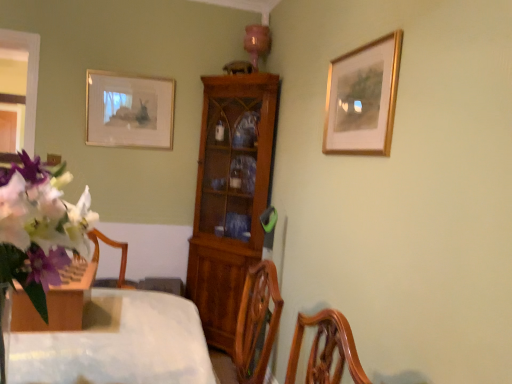
The height and width of the screenshot is (384, 512). I want to click on gold/golden picture frame at upper right, placed as the 2th picture frame when sorted from back to front, so click(362, 98).

Describe the element at coordinates (362, 98) in the screenshot. I see `gold/golden picture frame at upper right, the 2th picture frame when ordered from left to right` at that location.

Locate an element on the screen. wooden cabinet at center is located at coordinates (230, 196).

Is wooden cabinet at center positioned with its back to white matte flower at left?

No, white matte flower at left is not at the back of wooden cabinet at center.

In the image, is wooden cabinet at center positioned in front of or behind white matte flower at left?

wooden cabinet at center is positioned farther from the viewer than white matte flower at left.

What are the coordinates of `cabinetry on the right of white matte flower at left` in the screenshot? It's located at (230, 196).

Is wooden cabinet at center not close to white matte flower at left?

That's right, there is a large distance between wooden cabinet at center and white matte flower at left.

From the picture: Does wooden cabinet at center have a greater width compared to gold/golden picture frame at upper right, which is the first picture frame from front to back?

Indeed, wooden cabinet at center has a greater width compared to gold/golden picture frame at upper right, which is the first picture frame from front to back.

Can you confirm if wooden cabinet at center is bigger than gold/golden picture frame at upper right, placed as the 2th picture frame when sorted from back to front?

Correct, wooden cabinet at center is larger in size than gold/golden picture frame at upper right, placed as the 2th picture frame when sorted from back to front.

Considering the relative sizes of wooden cabinet at center and gold/golden picture frame at upper right, the 2th picture frame when ordered from left to right, in the image provided, is wooden cabinet at center taller than gold/golden picture frame at upper right, the 2th picture frame when ordered from left to right,?

Yes, wooden cabinet at center is taller than gold/golden picture frame at upper right, the 2th picture frame when ordered from left to right.

Relative to gold/golden picture frame at upper right, placed as the 2th picture frame when sorted from back to front, is wooden cabinet at center in front or behind?

wooden cabinet at center is positioned farther from the viewer than gold/golden picture frame at upper right, placed as the 2th picture frame when sorted from back to front.

Between white matte flower at left and wooden cabinet at center, which one has less height?

white matte flower at left.

From a real-world perspective, between white matte flower at left and wooden cabinet at center, who is vertically lower?

wooden cabinet at center.

Is white matte flower at left located outside wooden cabinet at center?

Absolutely, white matte flower at left is external to wooden cabinet at center.

Considering the relative positions of white matte flower at left and wooden cabinet at center in the image provided, is white matte flower at left in front of wooden cabinet at center?

Yes, it is.

In the scene shown: Would you consider gold/golden picture frame at upper right, placed as the 2th picture frame when sorted from back to front, to be distant from white matte flower at left?

Absolutely, gold/golden picture frame at upper right, placed as the 2th picture frame when sorted from back to front, is distant from white matte flower at left.

Between gold/golden picture frame at upper right, placed as the 2th picture frame when sorted from back to front, and white matte flower at left, which one has larger width?

white matte flower at left is wider.

Does point (367, 51) appear closer or farther from the camera than point (52, 251)?

Point (367, 51) appears to be farther away from the viewer than point (52, 251).

Which is in front, point (330, 144) or point (222, 111)?

Positioned in front is point (330, 144).

Is gold/golden picture frame at upper right, the 2th picture frame when ordered from left to right, closer to camera compared to wooden cabinet at center?

Yes, the depth of gold/golden picture frame at upper right, the 2th picture frame when ordered from left to right, is less than that of wooden cabinet at center.

From a real-world perspective, is gold/golden picture frame at upper right, placed as the 2th picture frame when sorted from back to front, below wooden cabinet at center?

No, from a real-world perspective, gold/golden picture frame at upper right, placed as the 2th picture frame when sorted from back to front, is not below wooden cabinet at center.

Do you think matte white picture frame at upper left, the second picture frame when ordered from front to back, is within wooden cabinet at center, or outside of it?

matte white picture frame at upper left, the second picture frame when ordered from front to back, is not enclosed by wooden cabinet at center.

Is matte white picture frame at upper left, the second picture frame when ordered from front to back, facing towards wooden cabinet at center?

No, matte white picture frame at upper left, the second picture frame when ordered from front to back, is not aimed at wooden cabinet at center.

Considering the points (101, 104) and (249, 91), which point is behind, point (101, 104) or point (249, 91)?

The point (101, 104) is farther from the camera.

Is matte white picture frame at upper left, which ranks as the 1th picture frame in back-to-front order, in front of or behind wooden cabinet at center in the image?

matte white picture frame at upper left, which ranks as the 1th picture frame in back-to-front order, is behind wooden cabinet at center.

Relative to matte white picture frame at upper left, which ranks as the 1th picture frame in back-to-front order, is gold/golden picture frame at upper right, placed as the 2th picture frame when sorted from back to front, in front or behind?

gold/golden picture frame at upper right, placed as the 2th picture frame when sorted from back to front, is in front of matte white picture frame at upper left, which ranks as the 1th picture frame in back-to-front order.

How many degrees apart are the facing directions of gold/golden picture frame at upper right, the 2th picture frame when ordered from left to right, and matte white picture frame at upper left, which ranks as the 1th picture frame in back-to-front order?

They differ by 88.5 degrees in their facing directions.

Is gold/golden picture frame at upper right, placed as the 2th picture frame when sorted from back to front, taller or shorter than matte white picture frame at upper left, which ranks as the 1th picture frame in back-to-front order?

gold/golden picture frame at upper right, placed as the 2th picture frame when sorted from back to front, is shorter than matte white picture frame at upper left, which ranks as the 1th picture frame in back-to-front order.

Where is `cabinetry that is behind the white matte flower at left`? This screenshot has width=512, height=384. cabinetry that is behind the white matte flower at left is located at coordinates (230, 196).

Locate an element on the screen. This screenshot has height=384, width=512. picture frame lying in front of the wooden cabinet at center is located at coordinates (362, 98).

Considering their positions, is white matte flower at left positioned closer to wooden cabinet at center than gold/golden picture frame at upper right, which ranks as the 1th picture frame in right-to-left order?

gold/golden picture frame at upper right, which ranks as the 1th picture frame in right-to-left order, lies closer to wooden cabinet at center than the other object.

Estimate the real-world distances between objects in this image. Which object is further from gold/golden picture frame at upper right, placed as the 2th picture frame when sorted from back to front, wooden cabinet at center or white matte flower at left?

wooden cabinet at center.

Estimate the real-world distances between objects in this image. Which object is further from matte white picture frame at upper left, which ranks as the 1th picture frame in back-to-front order, gold/golden picture frame at upper right, the 2th picture frame when ordered from left to right, or white matte flower at left?

white matte flower at left.

Looking at the image, which one is located further to gold/golden picture frame at upper right, which ranks as the 1th picture frame in right-to-left order, matte white picture frame at upper left, the second picture frame in the right-to-left sequence, or wooden cabinet at center?

matte white picture frame at upper left, the second picture frame in the right-to-left sequence, is positioned further to the anchor gold/golden picture frame at upper right, which ranks as the 1th picture frame in right-to-left order.

Consider the image. When comparing their distances from matte white picture frame at upper left, the second picture frame when ordered from front to back, does white matte flower at left or wooden cabinet at center seem closer?

wooden cabinet at center.

Looking at the image, which one is located further to matte white picture frame at upper left, the second picture frame when ordered from front to back, wooden cabinet at center or white matte flower at left?

The object further to matte white picture frame at upper left, the second picture frame when ordered from front to back, is white matte flower at left.

In the scene shown: Looking at the image, which one is located closer to gold/golden picture frame at upper right, which is the first picture frame from front to back, matte white picture frame at upper left, which ranks as the 1th picture frame in back-to-front order, or white matte flower at left?

Based on the image, white matte flower at left appears to be nearer to gold/golden picture frame at upper right, which is the first picture frame from front to back.

Based on their spatial positions, is gold/golden picture frame at upper right, placed as the 2th picture frame when sorted from back to front, or white matte flower at left further from wooden cabinet at center?

The object further to wooden cabinet at center is white matte flower at left.

Locate an element on the screen. picture frame located between white matte flower at left and wooden cabinet at center in the depth direction is located at coordinates (362, 98).

You are a GUI agent. You are given a task and a screenshot of the screen. Output one action in this format:
    pyautogui.click(x=<x>, y=<y>)
    Task: Click on the picture frame positioned between white matte flower at left and matte white picture frame at upper left, the second picture frame in the right-to-left sequence, from near to far
    
    Given the screenshot: What is the action you would take?
    pyautogui.click(x=362, y=98)

The width and height of the screenshot is (512, 384). I want to click on cabinetry between gold/golden picture frame at upper right, placed as the 2th picture frame when sorted from back to front, and matte white picture frame at upper left, which ranks as the 1th picture frame in back-to-front order, from front to back, so click(230, 196).

The height and width of the screenshot is (384, 512). What are the coordinates of `cabinetry located between white matte flower at left and matte white picture frame at upper left, the second picture frame in the right-to-left sequence, in the depth direction` in the screenshot? It's located at pyautogui.click(x=230, y=196).